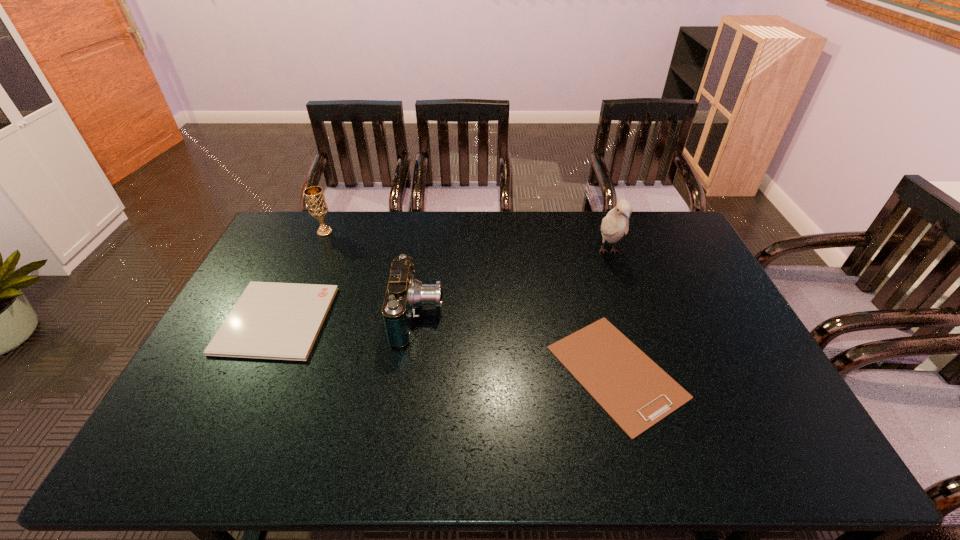
Identify the location of vacant area that lies between the chalice and the tallest object. This screenshot has height=540, width=960. (467, 242).

Where is `vacant space that is in between the shortest object and the tallest object`? vacant space that is in between the shortest object and the tallest object is located at coordinates (612, 312).

Locate an element on the screen. Image resolution: width=960 pixels, height=540 pixels. vacant point located between the chalice and the third object from left to right is located at coordinates (372, 274).

Identify which object is the closest to the chalice. Please provide its 2D coordinates. Your answer should be formatted as a tuple, i.e. [(x, y)], where the tuple contains the x and y coordinates of a point satisfying the conditions above.

[(270, 320)]

Choose which object is the fourth nearest neighbor to the right clipboard. Please provide its 2D coordinates. Your answer should be formatted as a tuple, i.e. [(x, y)], where the tuple contains the x and y coordinates of a point satisfying the conditions above.

[(317, 206)]

I want to click on free space that satisfies the following two spatial constraints: 1. on the front-facing side of the third shortest object; 2. on the front side of the taller clipboard, so click(x=418, y=320).

Find the location of a particular element. free point that satisfies the following two spatial constraints: 1. on the front-facing side of the camcorder; 2. on the right side of the right clipboard is located at coordinates (411, 372).

Identify the location of free space that satisfies the following two spatial constraints: 1. on the front-facing side of the shorter clipboard; 2. on the right side of the camcorder. The width and height of the screenshot is (960, 540). (411, 372).

The height and width of the screenshot is (540, 960). What are the coordinates of `vacant space that satisfies the following two spatial constraints: 1. on the front side of the right clipboard; 2. on the right side of the second shortest object` in the screenshot? It's located at (252, 372).